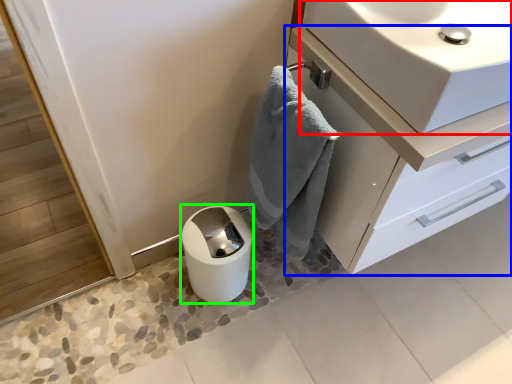
Question: Based on their relative distances, which object is farther from sink (highlighted by a red box)? Choose from bathroom cabinet (highlighted by a blue box) and paper towel (highlighted by a green box).

Choices:
 (A) bathroom cabinet
 (B) paper towel

Answer: (B)